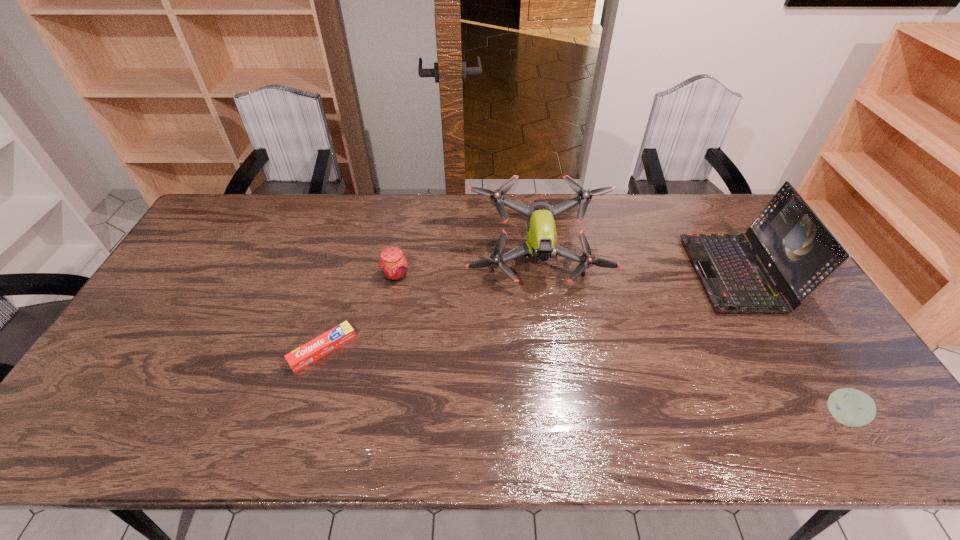
Locate an element on the screen. The height and width of the screenshot is (540, 960). object that is the fourth closest to the third object from left to right is located at coordinates (851, 407).

Image resolution: width=960 pixels, height=540 pixels. Identify the location of free space that satisfies the following two spatial constraints: 1. on the back side of the leftmost object; 2. on the left side of the second object from left to right. (345, 275).

You are a GUI agent. You are given a task and a screenshot of the screen. Output one action in this format:
    pyautogui.click(x=<x>, y=<y>)
    Task: Click on the vacant area that satisfies the following two spatial constraints: 1. on the front-facing side of the apple; 2. on the left side of the drone
    
    Given the screenshot: What is the action you would take?
    pyautogui.click(x=558, y=416)